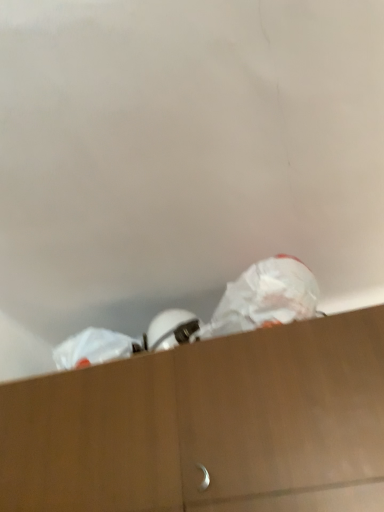
Measure the distance between white matte plastic bag at center and camera.

white matte plastic bag at center and camera are 3.78 feet apart.

You are a GUI agent. You are given a task and a screenshot of the screen. Output one action in this format:
    pyautogui.click(x=<x>, y=<y>)
    Task: Click on the white matte plastic bag at center
    This screenshot has height=512, width=384.
    Given the screenshot: What is the action you would take?
    pyautogui.click(x=264, y=298)

What do you see at coordinates (264, 298) in the screenshot?
I see `white matte plastic bag at center` at bounding box center [264, 298].

Locate an element on the screen. Image resolution: width=384 pixels, height=512 pixels. white matte plastic bag at center is located at coordinates (264, 298).